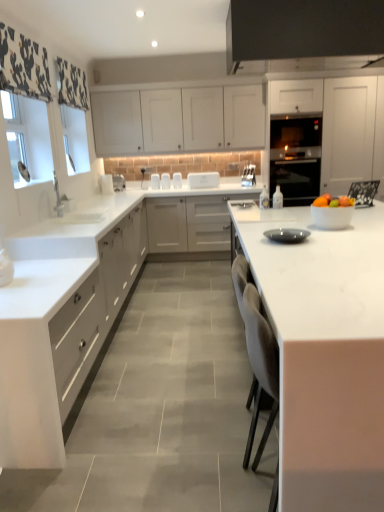
Find the location of a particular element. free space underneath matte gray plate at center, marked as the second appliance in a top-to-bottom arrangement (from a real-world perspective) is located at coordinates (302, 239).